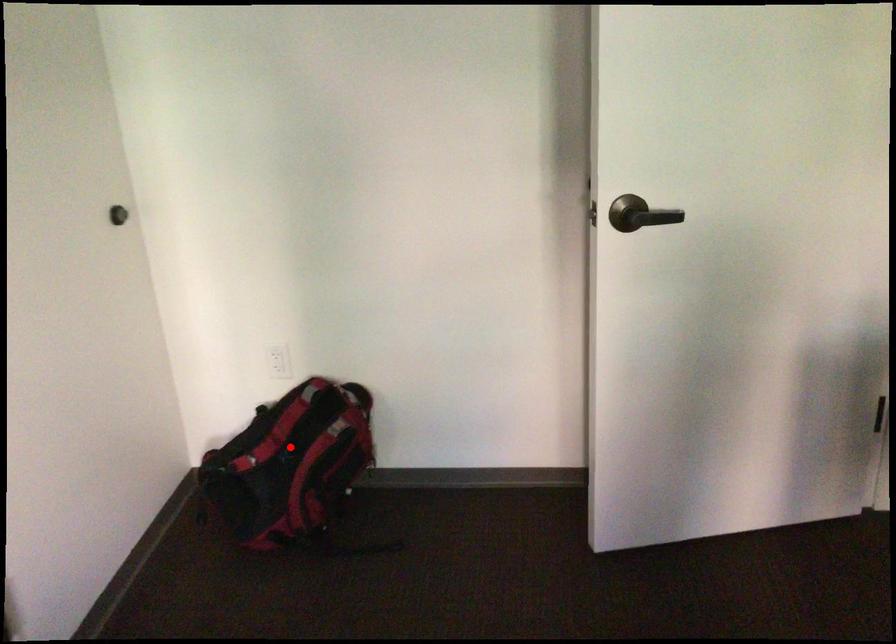
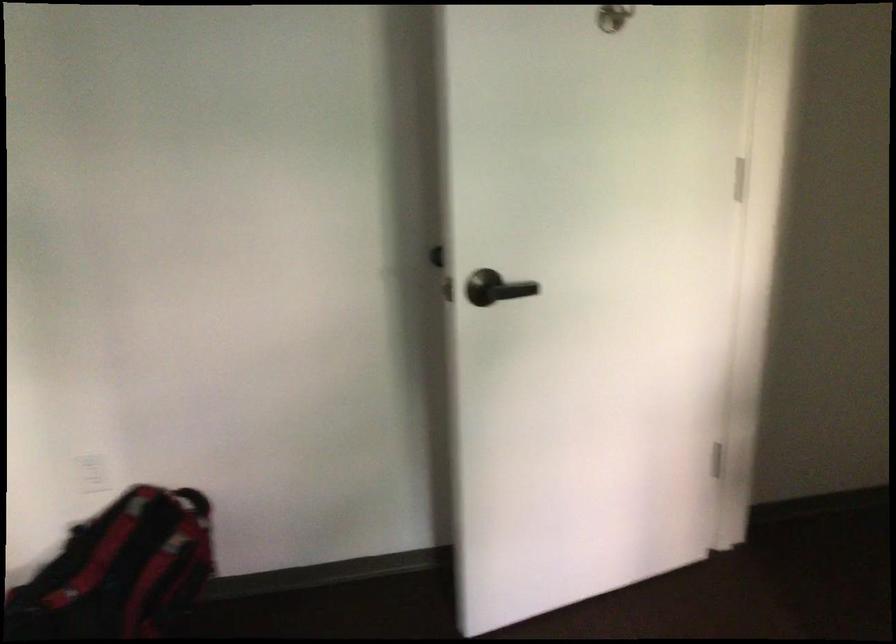
In the second image, find the point that corresponds to the highlighted location in the first image.

(119, 570)